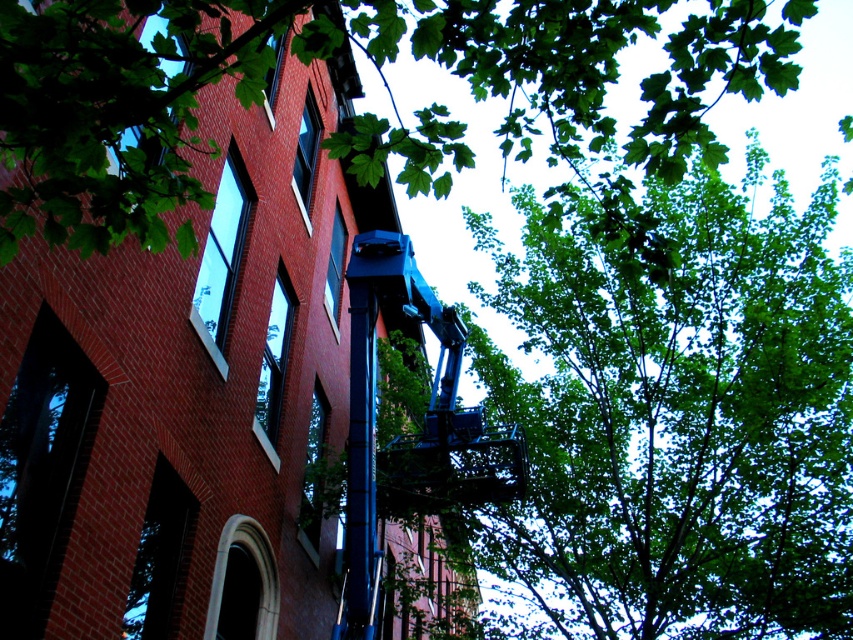
Question: Does green leafy tree at upper right have a larger size compared to green leafy tree at upper center?

Choices:
 (A) no
 (B) yes

Answer: (B)

Question: Does green leafy tree at upper right appear on the right side of green leafy tree at upper center?

Choices:
 (A) no
 (B) yes

Answer: (B)

Question: Which of the following is the farthest from the observer?

Choices:
 (A) (653, 26)
 (B) (550, 609)

Answer: (B)

Question: Among these points, which one is nearest to the camera?

Choices:
 (A) coord(27,29)
 (B) coord(514,518)

Answer: (A)

Question: Is green leafy tree at upper right positioned in front of green leafy tree at upper center?

Choices:
 (A) yes
 (B) no

Answer: (B)